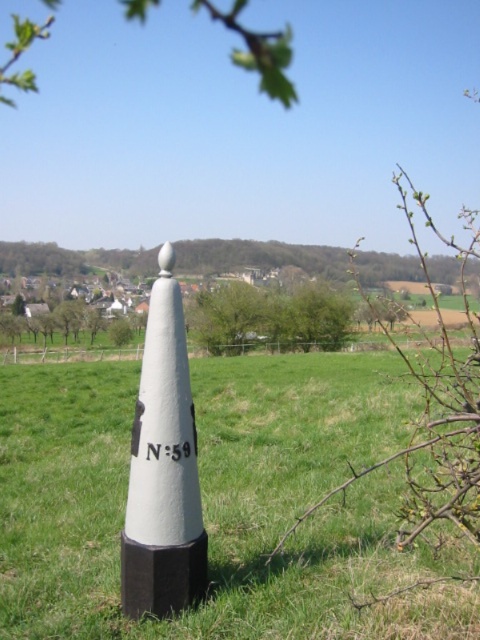
Question: Which is farther from the white painted concrete cone at center?

Choices:
 (A) green leafy branch at upper center
 (B) white matte cone at center

Answer: (A)

Question: Which of the following is the closest to the observer?

Choices:
 (A) white painted concrete cone at center
 (B) green leafy branch at upper center

Answer: (A)

Question: Does white matte cone at center have a greater width compared to white painted concrete cone at center?

Choices:
 (A) no
 (B) yes

Answer: (B)

Question: Where is white matte cone at center located in relation to green leafy branch at upper center in the image?

Choices:
 (A) above
 (B) below

Answer: (B)

Question: Is white painted concrete cone at center wider than green leafy branch at upper center?

Choices:
 (A) no
 (B) yes

Answer: (A)

Question: Which object appears farthest from the camera in this image?

Choices:
 (A) white matte cone at center
 (B) white painted concrete cone at center

Answer: (B)